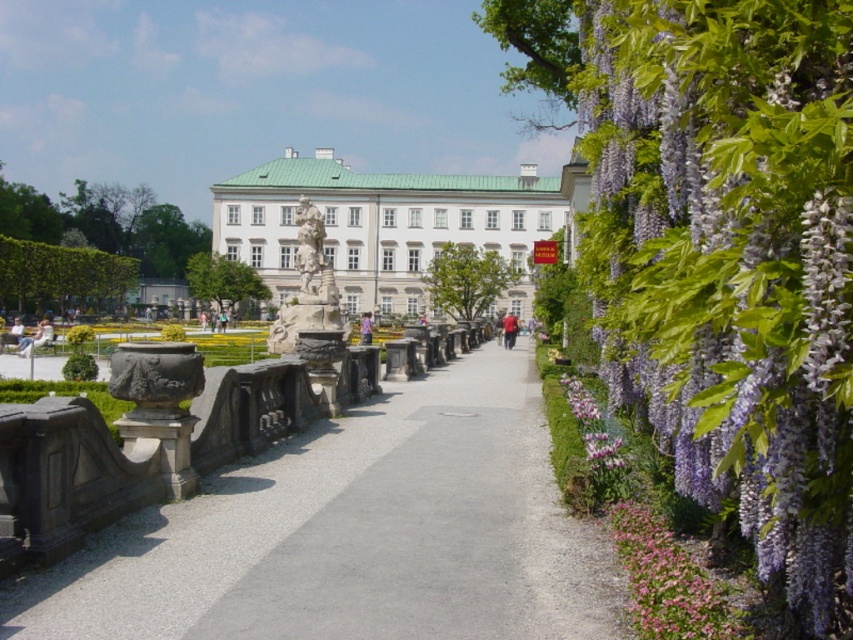
Does white glossy palace at center have a greater width compared to green leafy hedge at left?

Correct, the width of white glossy palace at center exceeds that of green leafy hedge at left.

Measure the distance between point (241,208) and camera.

Point (241,208) is 341.87 feet from camera.

This screenshot has height=640, width=853. I want to click on white glossy palace at center, so click(x=383, y=225).

Does point (595, 541) lie in front of point (108, 284)?

Yes, point (595, 541) is closer to viewer.

Consider the image. Does gray gravel path at center have a lesser width compared to green leafy hedge at left?

Yes.

Is point (332, 509) closer to viewer compared to point (51, 256)?

Yes, it is.

Find the location of a particular element. gray gravel path at center is located at coordinates (355, 532).

Is green leafy hedge at left wider than white marble statue at center?

No.

Between green leafy hedge at left and white marble statue at center, which one appears on the left side from the viewer's perspective?

From the viewer's perspective, green leafy hedge at left appears more on the left side.

Image resolution: width=853 pixels, height=640 pixels. What do you see at coordinates (61, 276) in the screenshot?
I see `green leafy hedge at left` at bounding box center [61, 276].

At what (x,y) coordinates should I click in order to perform the action: click on green leafy hedge at left. Please return your answer as a coordinate pair (x, y). Looking at the image, I should click on (61, 276).